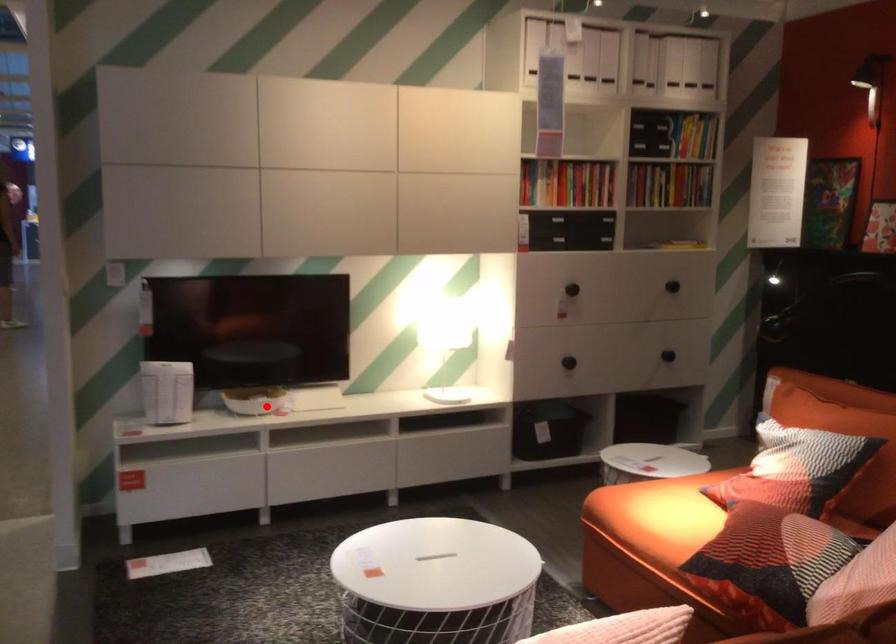
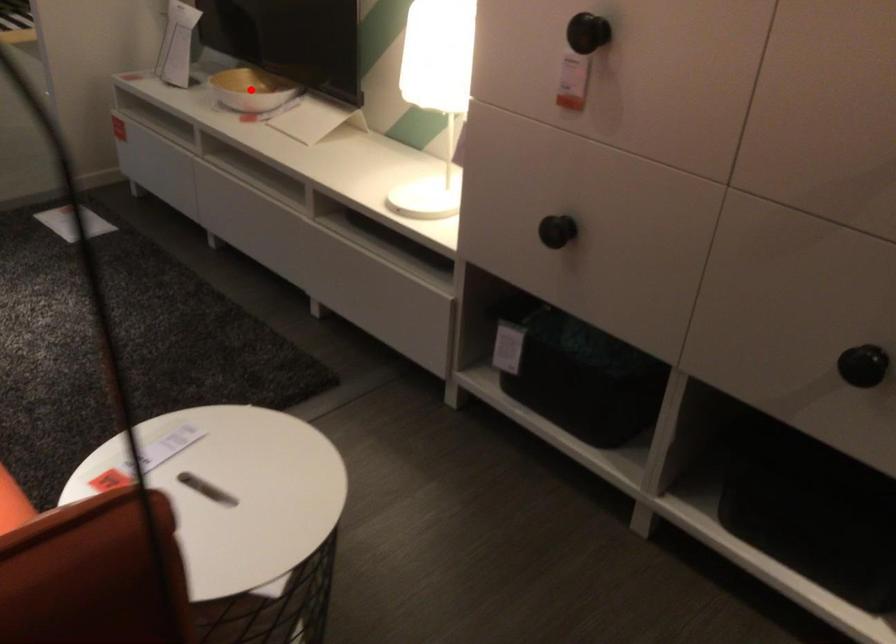
I am providing you with two images of the same scene from different viewpoints. A red point is marked on the first image and another point is marked on the second image. Do the highlighted points in image1 and image2 indicate the same real-world spot?

Yes